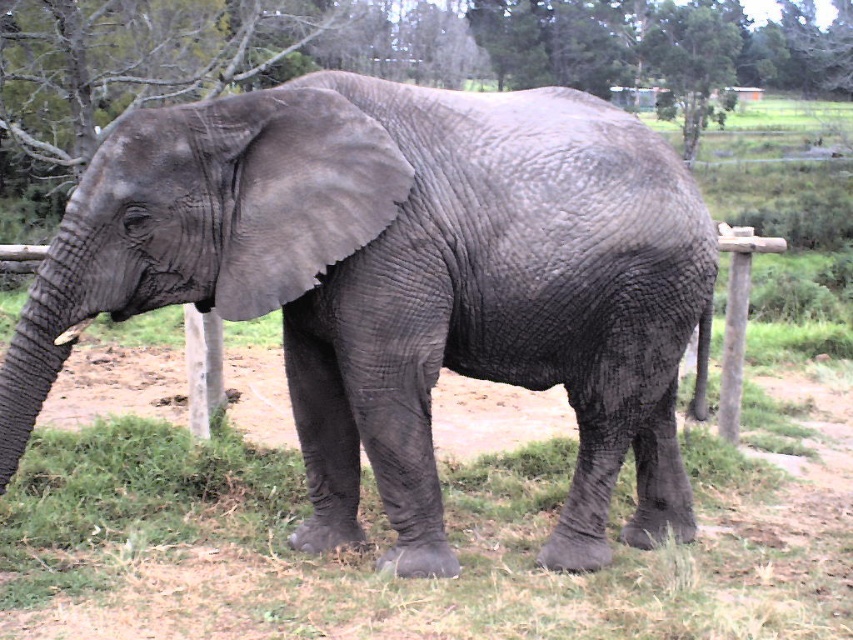
Who is taller, gray rough elephant at center or green leafy tree at upper center?

Standing taller between the two is green leafy tree at upper center.

Does gray rough elephant at center appear on the right side of green leafy tree at upper center?

Incorrect, gray rough elephant at center is not on the right side of green leafy tree at upper center.

Is point (508, 129) positioned behind point (732, 33)?

No, (508, 129) is in front of (732, 33).

Locate an element on the screen. gray rough elephant at center is located at coordinates (404, 282).